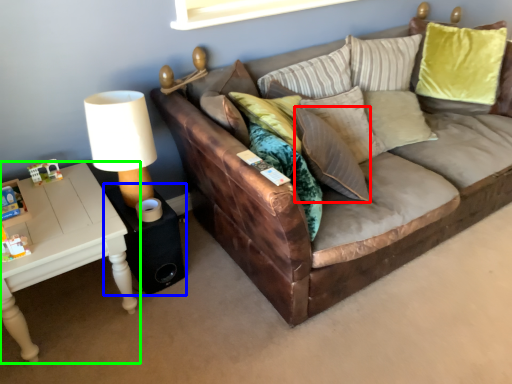
Question: Which object is positioned farthest from pillow (highlighted by a red box)? Select from side table (highlighted by a blue box) and table (highlighted by a green box).

Choices:
 (A) side table
 (B) table

Answer: (B)